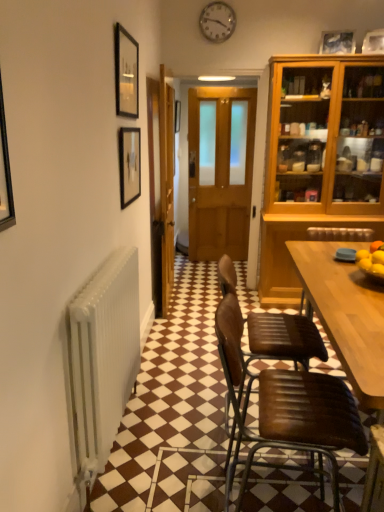
Question: Considering the relative sizes of matte black picture frame at upper left, arranged as the 2th picture frame when ordered from the bottom, and brown leather chair at lower right, acting as the first chair starting from the front, in the image provided, is matte black picture frame at upper left, arranged as the 2th picture frame when ordered from the bottom, thinner than brown leather chair at lower right, acting as the first chair starting from the front,?

Choices:
 (A) no
 (B) yes

Answer: (B)

Question: Is matte black picture frame at upper left, arranged as the 2th picture frame when ordered from the bottom, wider than brown leather chair at lower right, acting as the first chair starting from the front?

Choices:
 (A) no
 (B) yes

Answer: (A)

Question: Is matte black picture frame at upper left, positioned as the second picture frame in right-to-left order, touching brown leather chair at lower right, the second chair viewed from the back?

Choices:
 (A) yes
 (B) no

Answer: (B)

Question: From the image's perspective, is matte black picture frame at upper left, arranged as the third picture frame when viewed from the back, located beneath brown leather chair at lower right, the second chair viewed from the back?

Choices:
 (A) yes
 (B) no

Answer: (B)

Question: Considering the relative sizes of matte black picture frame at upper left, marked as the 1th picture frame in a front-to-back arrangement, and brown leather chair at lower right, acting as the first chair starting from the front, in the image provided, is matte black picture frame at upper left, marked as the 1th picture frame in a front-to-back arrangement, shorter than brown leather chair at lower right, acting as the first chair starting from the front,?

Choices:
 (A) no
 (B) yes

Answer: (B)

Question: Visually, is metallic clock at upper center positioned to the left or to the right of wooden door at center, the 1th door from the right?

Choices:
 (A) left
 (B) right

Answer: (B)

Question: Considering the positions of point (226, 20) and point (193, 141), is point (226, 20) closer or farther from the camera than point (193, 141)?

Choices:
 (A) closer
 (B) farther

Answer: (A)

Question: From a real-world perspective, is metallic clock at upper center positioned above or below wooden door at center, which is the second door from left to right?

Choices:
 (A) below
 (B) above

Answer: (B)

Question: Is metallic clock at upper center taller or shorter than wooden door at center, the 1th door from the right?

Choices:
 (A) short
 (B) tall

Answer: (A)

Question: From a real-world perspective, is matte black picture frame at upper right, placed as the third picture frame when sorted from bottom to top, physically located above or below matte black picture frame at upper left, the 2th picture frame when ordered from top to bottom?

Choices:
 (A) below
 (B) above

Answer: (B)

Question: In the image, is matte black picture frame at upper right, placed as the third picture frame when sorted from bottom to top, positioned in front of or behind matte black picture frame at upper left, marked as the 1th picture frame in a front-to-back arrangement?

Choices:
 (A) front
 (B) behind

Answer: (B)

Question: From the image's perspective, is matte black picture frame at upper right, arranged as the 1th picture frame when viewed from the top, above or below matte black picture frame at upper left, the 2th picture frame when ordered from top to bottom?

Choices:
 (A) above
 (B) below

Answer: (A)

Question: Do you think matte black picture frame at upper right, placed as the 1th picture frame when sorted from back to front, is within matte black picture frame at upper left, the 2th picture frame when ordered from top to bottom, or outside of it?

Choices:
 (A) inside
 (B) outside

Answer: (B)

Question: Based on their positions, is white metallic radiator at left located to the left or right of wooden door at center, the 1th door from the right?

Choices:
 (A) left
 (B) right

Answer: (A)

Question: Is point (71, 311) positioned closer to the camera than point (206, 151)?

Choices:
 (A) closer
 (B) farther

Answer: (A)